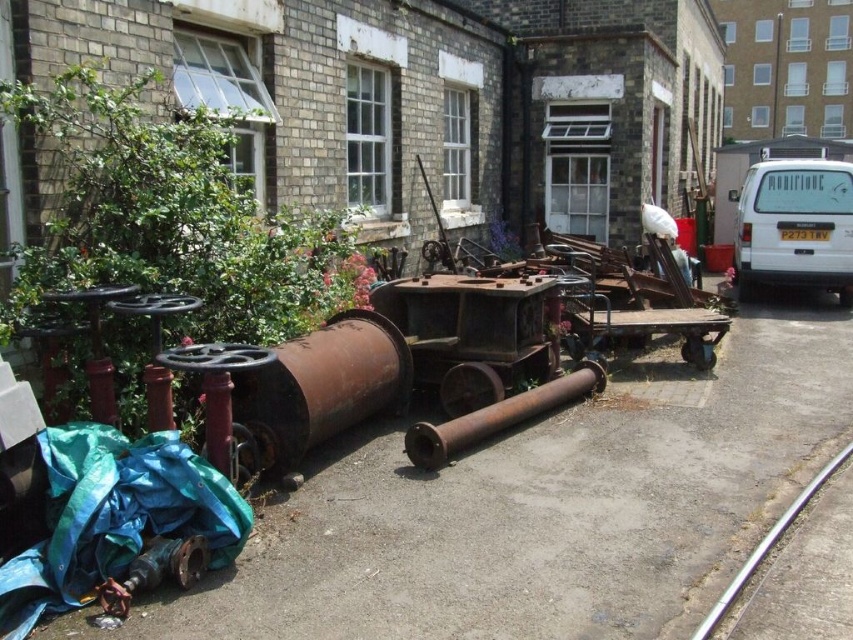
This screenshot has height=640, width=853. Find the location of `blue tarpaulin at lower left`. blue tarpaulin at lower left is located at coordinates (114, 516).

Does point (131, 524) lie in front of point (437, 428)?

Yes.

The image size is (853, 640). In order to click on blue tarpaulin at lower left in this screenshot , I will do `click(114, 516)`.

This screenshot has height=640, width=853. What are the coordinates of `blue tarpaulin at lower left` in the screenshot? It's located at (114, 516).

Which is more to the right, blue tarpaulin at lower left or silver metallic rail at lower right?

Positioned to the right is silver metallic rail at lower right.

Does blue tarpaulin at lower left appear under silver metallic rail at lower right?

Incorrect, blue tarpaulin at lower left is not positioned below silver metallic rail at lower right.

Who is more distant from viewer, (84,445) or (767,552)?

Positioned behind is point (767,552).

This screenshot has height=640, width=853. What are the coordinates of `blue tarpaulin at lower left` in the screenshot? It's located at (114, 516).

Is blue tarpaulin at lower left taller than white matte van at upper right?

No.

Who is positioned more to the right, blue tarpaulin at lower left or white matte van at upper right?

From the viewer's perspective, white matte van at upper right appears more on the right side.

Between point (80, 525) and point (764, 257), which one is positioned in front?

Positioned in front is point (80, 525).

Locate an element on the screen. Image resolution: width=853 pixels, height=640 pixels. blue tarpaulin at lower left is located at coordinates (114, 516).